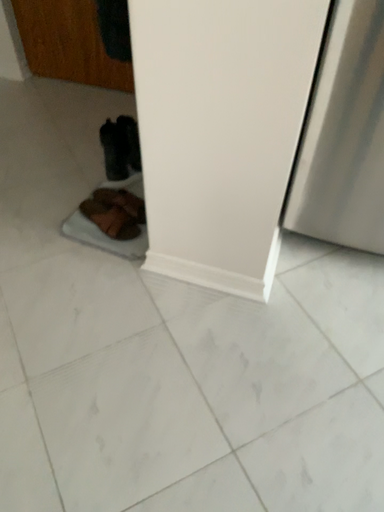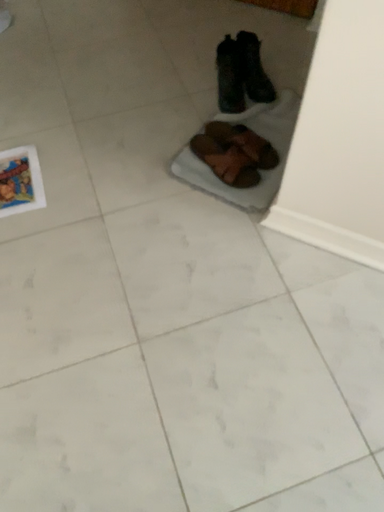
Question: How did the camera likely rotate when shooting the video?

Choices:
 (A) rotated left
 (B) rotated right

Answer: (A)